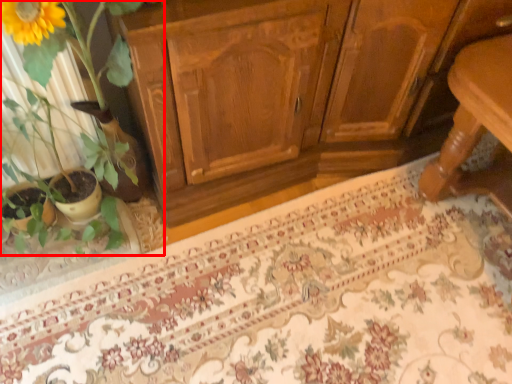
Question: From the image's perspective, considering the relative positions of houseplant (annotated by the red box) and doormat in the image provided, where is houseplant (annotated by the red box) located with respect to the staircase?

Choices:
 (A) below
 (B) above

Answer: (B)